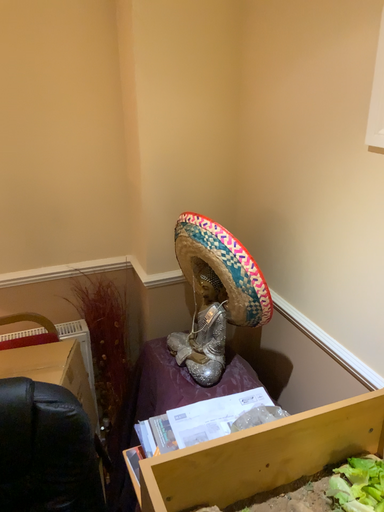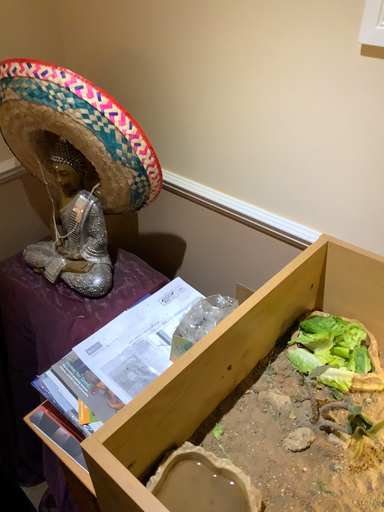
Question: Which way did the camera rotate in the video?

Choices:
 (A) rotated downward
 (B) rotated upward

Answer: (A)